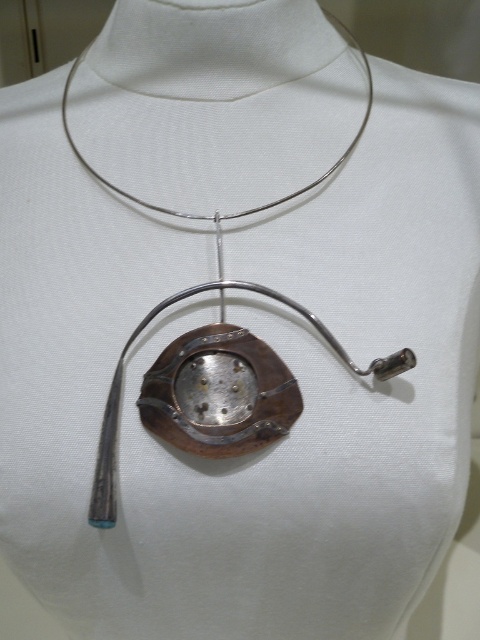
You are an appraiser examining a necklace with two pendants. You see the rusty metal pendant at center and the polished silver pendant at center. Which pendant is positioned to the left?

The rusty metal pendant at center is to the left of the polished silver pendant at center.